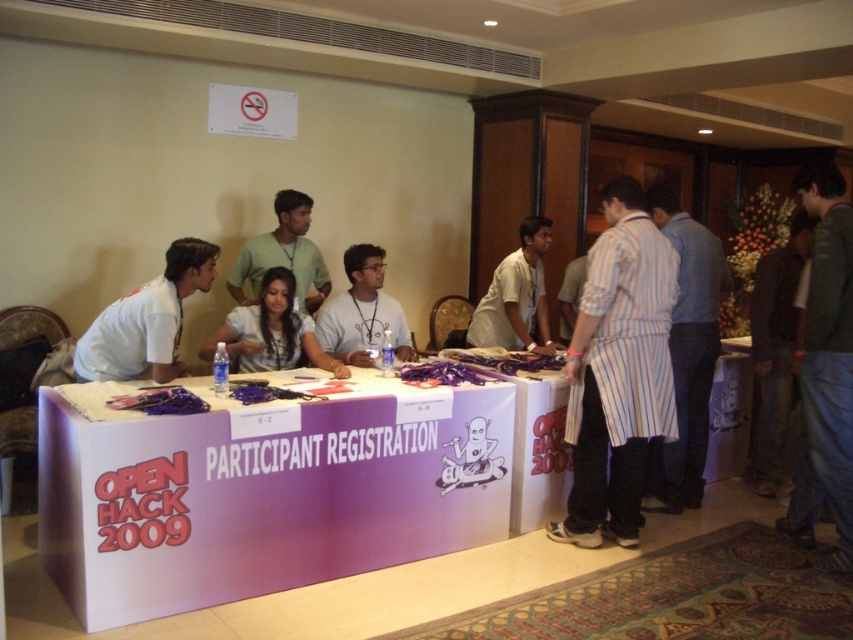
Question: Which point is closer to the camera?

Choices:
 (A) purple paperboard at center
 (B) matte white shirt at center
 (C) striped cotton shirt at center

Answer: (A)

Question: Is dark brown leather jacket at right to the left of green cotton shirt at center from the viewer's perspective?

Choices:
 (A) yes
 (B) no

Answer: (B)

Question: Which is farther from the dark brown leather jacket at right?

Choices:
 (A) white striped shirt at center
 (B) striped cotton shirt at center

Answer: (A)

Question: Can you confirm if striped cotton shirt at right is positioned below dark brown leather jacket at right?

Choices:
 (A) yes
 (B) no

Answer: (A)

Question: Which of the following is the farthest from the observer?

Choices:
 (A) (289, 291)
 (B) (263, 273)

Answer: (B)

Question: Does green fabric shirt at right have a greater width compared to striped cotton shirt at center?

Choices:
 (A) yes
 (B) no

Answer: (B)